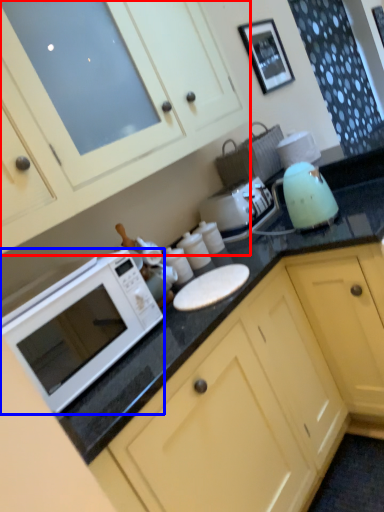
Question: Among these objects, which one is farthest to the camera, cabinetry (highlighted by a red box) or microwave oven (highlighted by a blue box)?

Choices:
 (A) cabinetry
 (B) microwave oven

Answer: (B)